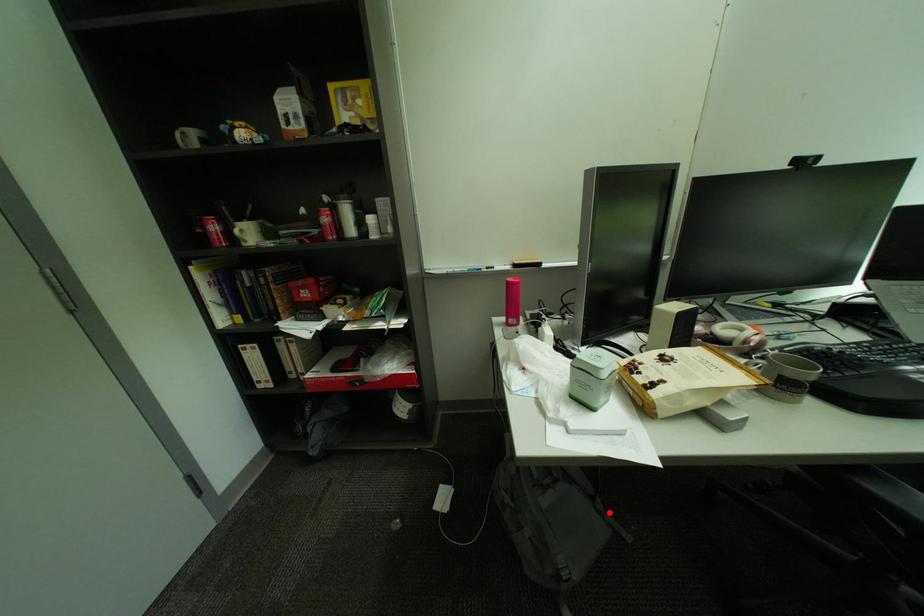
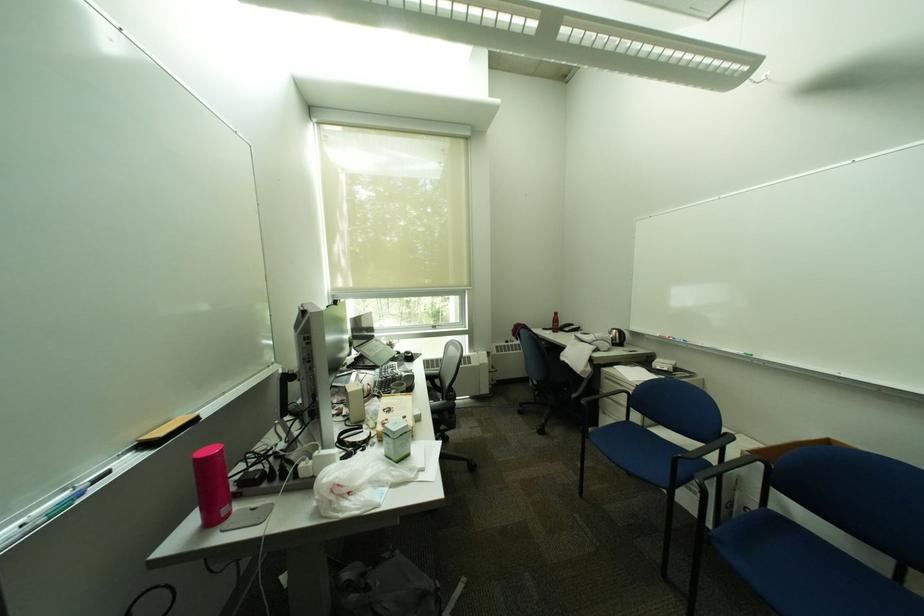
Find the pixel in the second image that matches the highlighted location in the first image.

(400, 560)